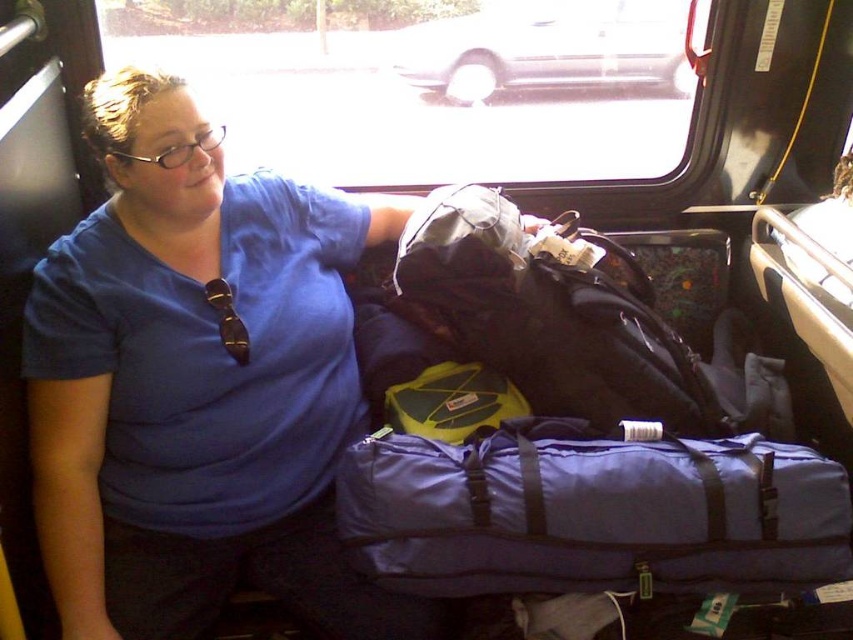
Question: Which of these objects is positioned farthest from the white matte car at upper center?

Choices:
 (A) purple nylon duffel bag at lower center
 (B) blue cotton shirt at left

Answer: (A)

Question: Which is nearer to the purple nylon duffel bag at lower center?

Choices:
 (A) blue cotton shirt at left
 (B) white matte car at upper center

Answer: (A)

Question: Does blue cotton shirt at left appear on the right side of white matte car at upper center?

Choices:
 (A) no
 (B) yes

Answer: (A)

Question: Which of the following is the closest to the observer?

Choices:
 (A) (138, 474)
 (B) (622, 500)

Answer: (B)

Question: Does purple nylon duffel bag at lower center appear over white matte car at upper center?

Choices:
 (A) no
 (B) yes

Answer: (A)

Question: Does blue cotton shirt at left appear under purple nylon duffel bag at lower center?

Choices:
 (A) no
 (B) yes

Answer: (A)